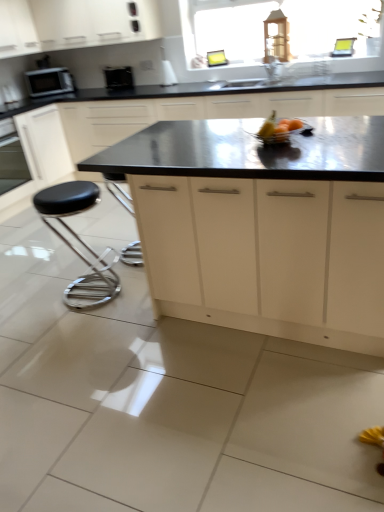
Identify the location of vacant area situated below black glossy microwave at upper left (from a real-world perspective). (127, 86).